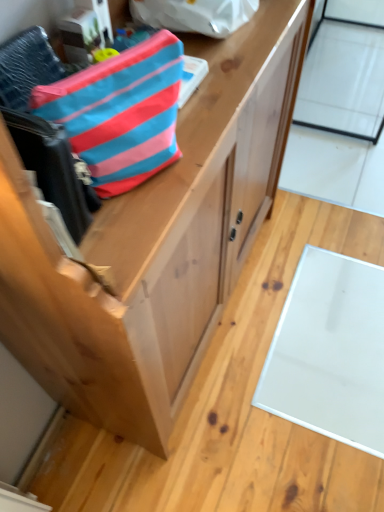
Where is `free region under transparent glass door at upper right (from a real-world perspective)`? The width and height of the screenshot is (384, 512). free region under transparent glass door at upper right (from a real-world perspective) is located at coordinates (344, 75).